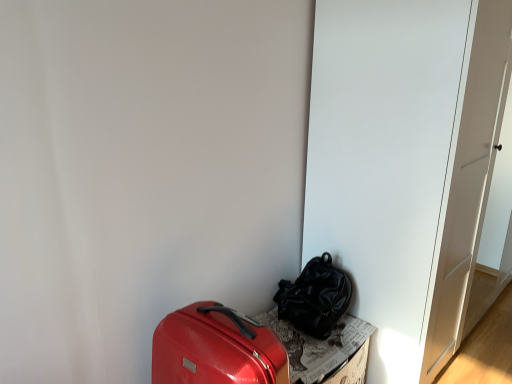
Question: From a real-world perspective, relative to shiny red suitcase at lower left, placed as the second luggage and bags when sorted from right to left, is shiny black backpack at center, which is counted as the second luggage and bags, starting from the front, vertically above or below?

Choices:
 (A) below
 (B) above

Answer: (B)

Question: Is point (322, 273) closer or farther from the camera than point (231, 327)?

Choices:
 (A) farther
 (B) closer

Answer: (A)

Question: Which is farther from the cardboard textured box at lower right?

Choices:
 (A) shiny red suitcase at lower left, the first luggage and bags when ordered from left to right
 (B) shiny black backpack at center, the 1th luggage and bags when ordered from back to front
 (C) white matte door at center

Answer: (C)

Question: Estimate the real-world distances between objects in this image. Which object is closer to the shiny black backpack at center, acting as the second luggage and bags starting from the left?

Choices:
 (A) white matte door at center
 (B) cardboard textured box at lower right
 (C) shiny red suitcase at lower left, the first luggage and bags when ordered from left to right

Answer: (B)